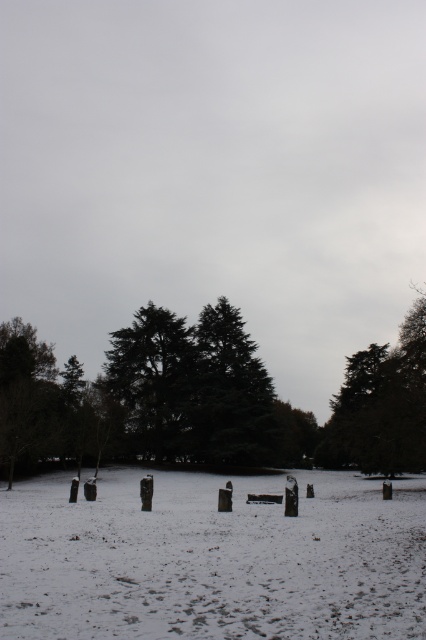
Question: Is the position of green matte tree at right less distant than that of green textured tree at center?

Choices:
 (A) no
 (B) yes

Answer: (B)

Question: Which point is closer to the camera?

Choices:
 (A) (155, 314)
 (B) (382, 428)

Answer: (B)

Question: Where is green matte tree at right located in relation to green textured tree at center in the image?

Choices:
 (A) right
 (B) left

Answer: (A)

Question: Is green matte tree at right bigger than green textured tree at center?

Choices:
 (A) yes
 (B) no

Answer: (A)

Question: Which point appears farthest from the camera in this image?

Choices:
 (A) (186, 371)
 (B) (371, 356)

Answer: (B)